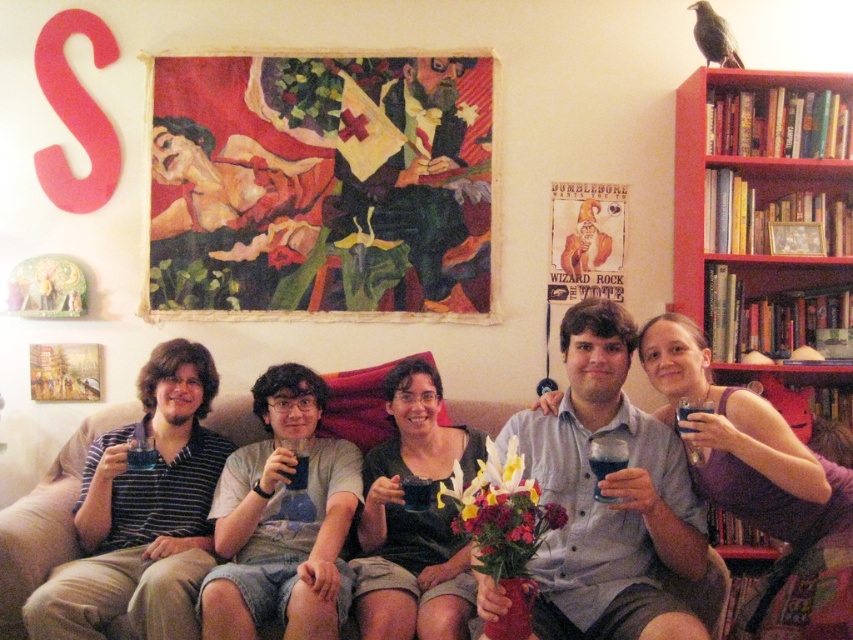
You are standing at a certain point in the room and want to place a 2.5 meter long banner between you and the point marked as point (459, 572). Will the banner fit without overlapping anything?

The distance between you and point (459, 572) is 2.12 meters. Since the banner is 2.5 meters long, it will not fit as it is longer than the available space.

Looking at this image, you are a guest at this gathering and want to know if the black matte dress at center can be hung on the red wood bookshelf at upper right. Based on their heights, can it fit?

The black matte dress at center is shorter than the red wood bookshelf at upper right, so it can be hung on it.